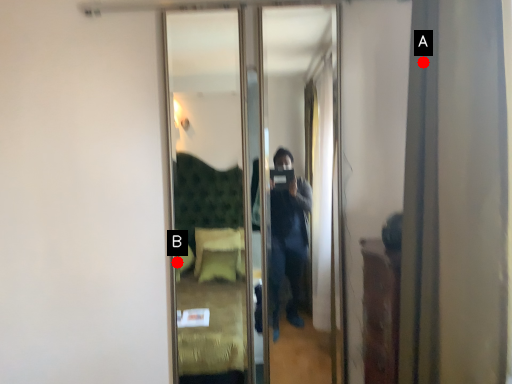
Question: Two points are circled on the image, labeled by A and B beside each circle. Among these points, which one is nearest to the camera?

Choices:
 (A) A is closer
 (B) B is closer

Answer: (A)